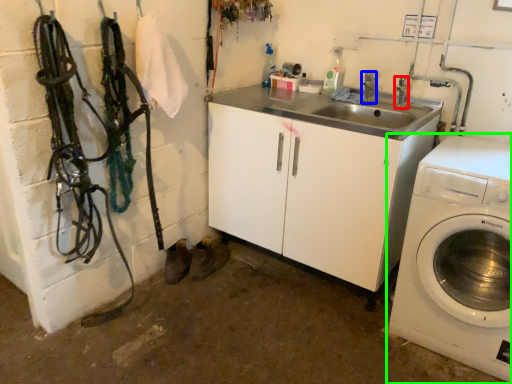
Question: Estimate the real-world distances between objects in this image. Which object is closer to faucet (highlighted by a red box), faucet (highlighted by a blue box) or washing machine (highlighted by a green box)?

Choices:
 (A) faucet
 (B) washing machine

Answer: (A)